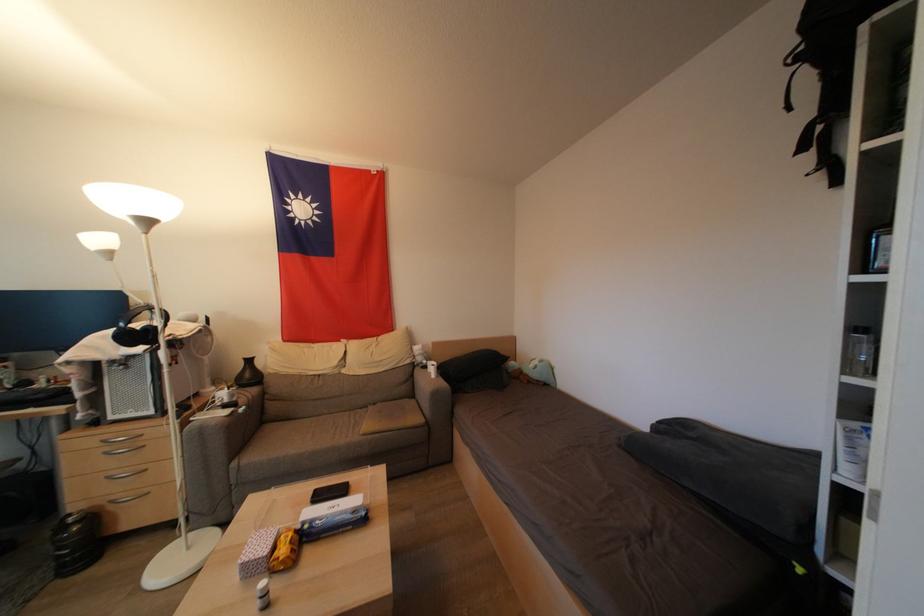
Identify the location of glass jar. (x=858, y=352).